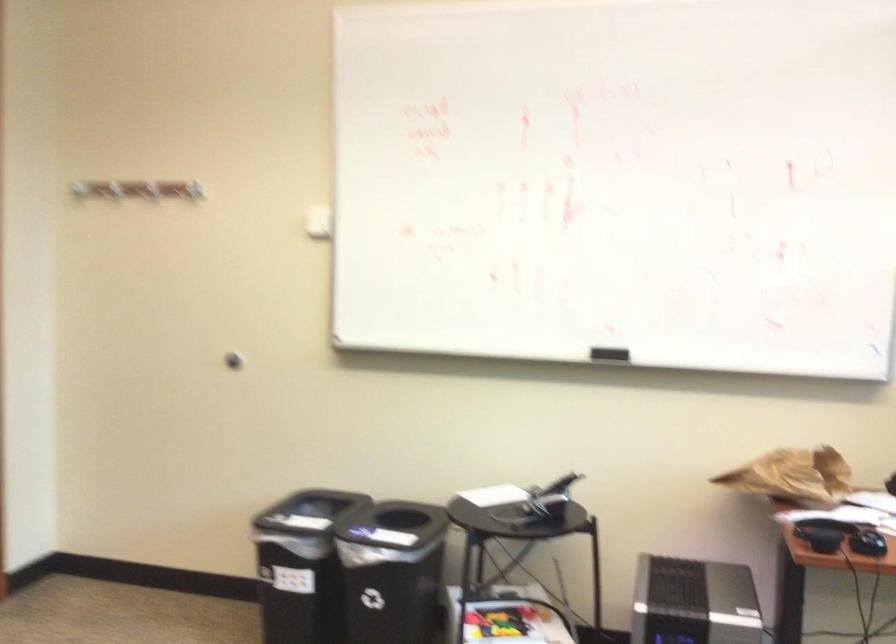
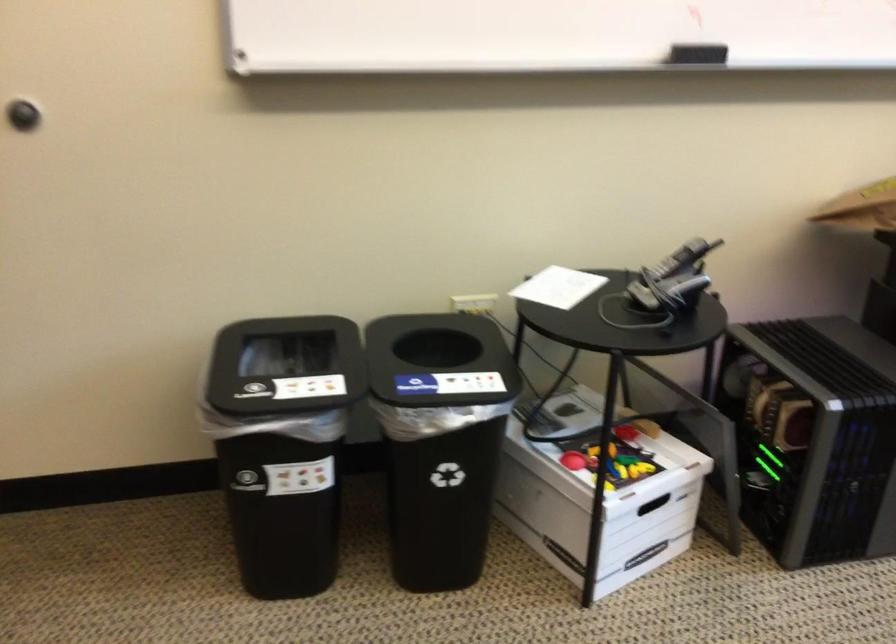
In the second image, find the point that corresponds to point (608, 355) in the first image.

(696, 53)